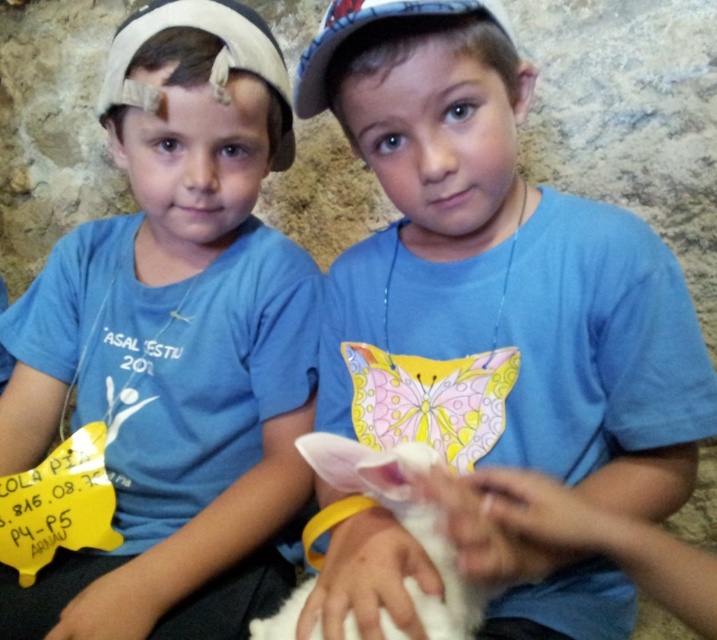
Question: Which object is closer to the camera taking this photo?

Choices:
 (A) blue cotton shirt at center
 (B) white fluffy rabbit at center

Answer: (A)

Question: Which point appears farthest from the camera in this image?

Choices:
 (A) (100, 124)
 (B) (632, 396)
 (C) (299, 605)
 (D) (315, 44)

Answer: (A)

Question: Does blue cotton shirt at center lie behind white fabric baseball cap at upper center?

Choices:
 (A) yes
 (B) no

Answer: (B)

Question: Where is blue matte shirt at center located in relation to white fluffy rabbit at center in the image?

Choices:
 (A) below
 (B) above

Answer: (B)

Question: Can you confirm if white fluffy rabbit at center is positioned to the left of white fabric baseball cap at upper center?

Choices:
 (A) no
 (B) yes

Answer: (B)

Question: Which is nearer to the blue matte shirt at center?

Choices:
 (A) white fabric baseball cap at upper center
 (B) white fluffy rabbit at center
 (C) blue cotton shirt at center

Answer: (C)